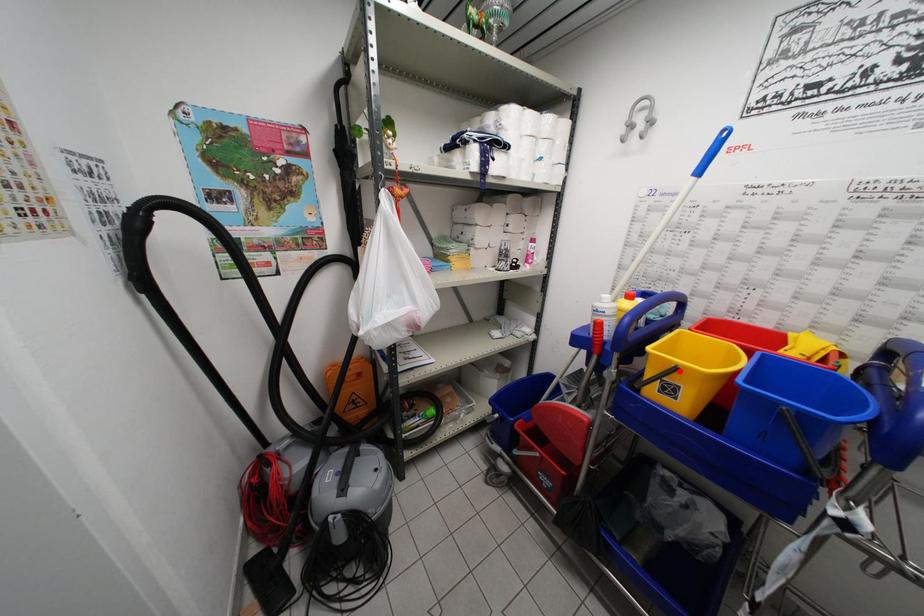
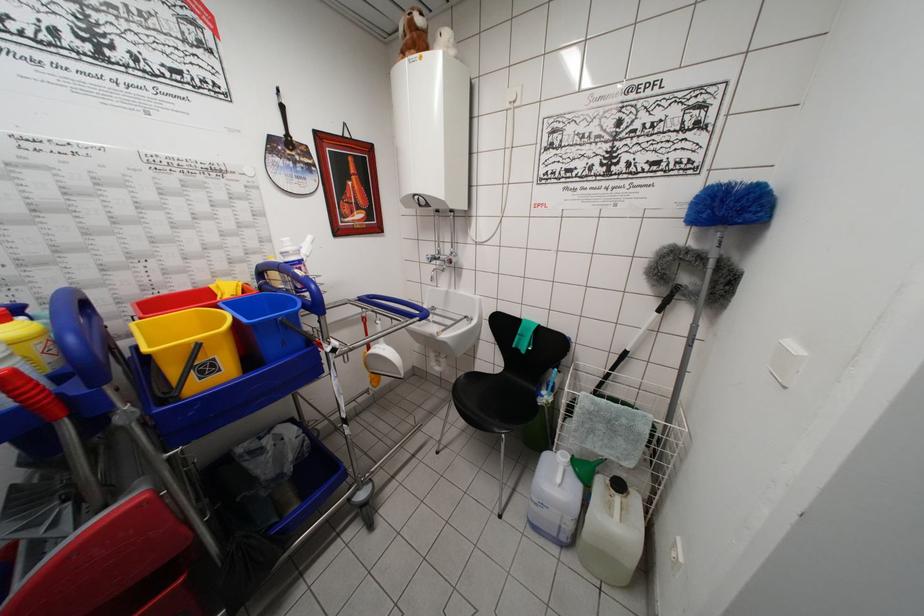
Question: I am providing you with two images of the same scene from different viewpoints. Image1 has a red point marked. In image2, the corresponding 3D location appears at what relative position? Reply with the corresponding letter.

Choices:
 (A) Closer
 (B) Farther

Answer: (B)